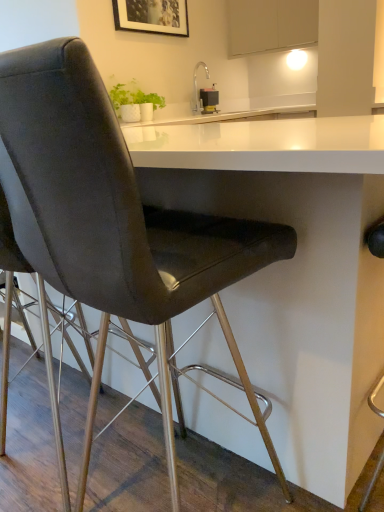
Question: Is metallic rectangular device at upper center completely or partially inside white matte cabinet at upper center?

Choices:
 (A) no
 (B) yes

Answer: (A)

Question: Considering the relative sizes of white matte cabinet at upper center and metallic rectangular device at upper center in the image provided, is white matte cabinet at upper center taller than metallic rectangular device at upper center?

Choices:
 (A) yes
 (B) no

Answer: (A)

Question: Are white matte cabinet at upper center and metallic rectangular device at upper center making contact?

Choices:
 (A) yes
 (B) no

Answer: (B)

Question: Can you confirm if white matte cabinet at upper center is smaller than metallic rectangular device at upper center?

Choices:
 (A) no
 (B) yes

Answer: (A)

Question: Can you confirm if white matte cabinet at upper center is thinner than metallic rectangular device at upper center?

Choices:
 (A) no
 (B) yes

Answer: (A)

Question: Is satin nickel faucet at upper center situated inside wooden picture frame at upper center or outside?

Choices:
 (A) outside
 (B) inside

Answer: (A)

Question: In the image, is satin nickel faucet at upper center positioned in front of or behind wooden picture frame at upper center?

Choices:
 (A) front
 (B) behind

Answer: (B)

Question: From the image's perspective, is satin nickel faucet at upper center positioned above or below wooden picture frame at upper center?

Choices:
 (A) below
 (B) above

Answer: (A)

Question: Considering the positions of point (208, 75) and point (120, 4), is point (208, 75) closer or farther from the camera than point (120, 4)?

Choices:
 (A) closer
 (B) farther

Answer: (B)

Question: Is white matte cabinet at upper center in front of or behind wooden picture frame at upper center in the image?

Choices:
 (A) front
 (B) behind

Answer: (B)

Question: From the image's perspective, is white matte cabinet at upper center positioned above or below wooden picture frame at upper center?

Choices:
 (A) above
 (B) below

Answer: (A)

Question: Looking at their shapes, would you say white matte cabinet at upper center is wider or thinner than wooden picture frame at upper center?

Choices:
 (A) wide
 (B) thin

Answer: (A)

Question: Is white matte cabinet at upper center to the left or to the right of wooden picture frame at upper center in the image?

Choices:
 (A) right
 (B) left

Answer: (A)

Question: From their relative heights in the image, would you say satin nickel faucet at upper center is taller or shorter than metallic rectangular device at upper center?

Choices:
 (A) tall
 (B) short

Answer: (A)

Question: In the image, is satin nickel faucet at upper center positioned in front of or behind metallic rectangular device at upper center?

Choices:
 (A) front
 (B) behind

Answer: (A)